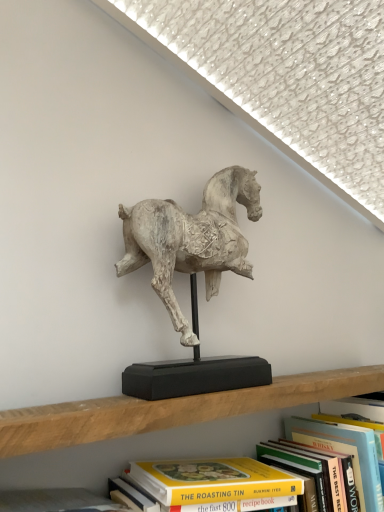
Question: Is point (347, 493) positioned closer to the camera than point (367, 464)?

Choices:
 (A) closer
 (B) farther

Answer: (A)

Question: Looking at the image, does yellow paperback book at center, placed as the first book when sorted from left to right, seem bigger or smaller compared to hardcover book at upper center, arranged as the 1th book when viewed from the right?

Choices:
 (A) small
 (B) big

Answer: (B)

Question: Estimate the real-world distances between objects in this image. Which object is farther from the white textured horse at center?

Choices:
 (A) hardcover book at upper center, the 2th book in the left-to-right sequence
 (B) yellow paperback book at center, placed as the first book when sorted from left to right

Answer: (A)

Question: Which is farther from the white textured horse at center?

Choices:
 (A) hardcover book at upper center, the 2th book in the left-to-right sequence
 (B) yellow paperback book at center, positioned as the 2th book in right-to-left order

Answer: (A)